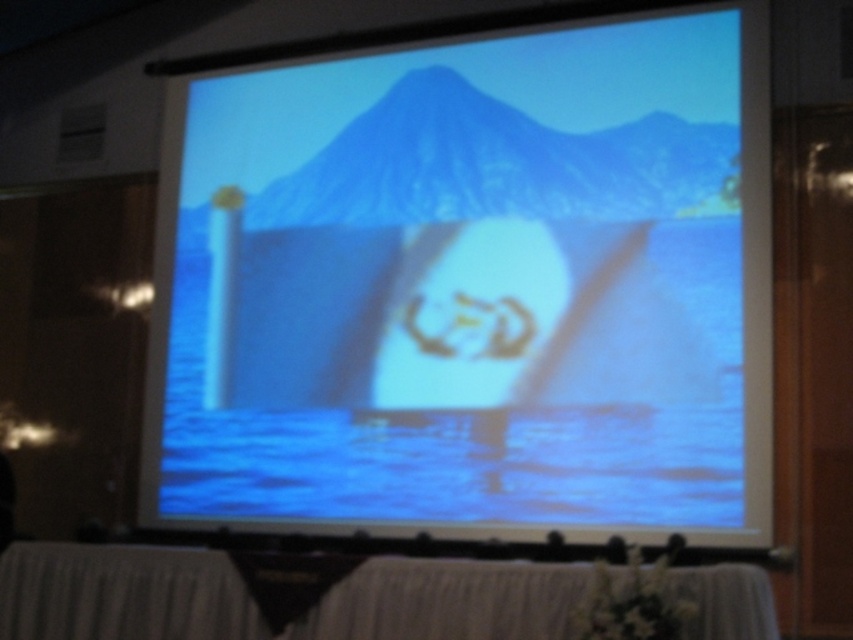
You are setting up a presentation and need to ensure that the white cloth at lower center does not cover the white matte projection screen at center. Based on their sizes, can you determine if the cloth will fit below the screen without overlapping?

The white matte projection screen at center is taller than the white cloth at lower center, so the cloth will fit below the screen without overlapping as it is shorter in height.